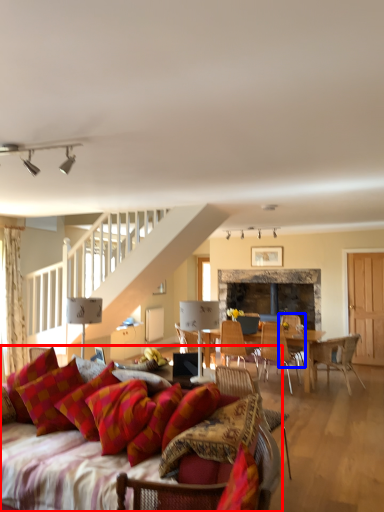
Question: Among these objects, which one is nearest to the camera, studio couch (highlighted by a red box) or chair (highlighted by a blue box)?

Choices:
 (A) studio couch
 (B) chair

Answer: (A)